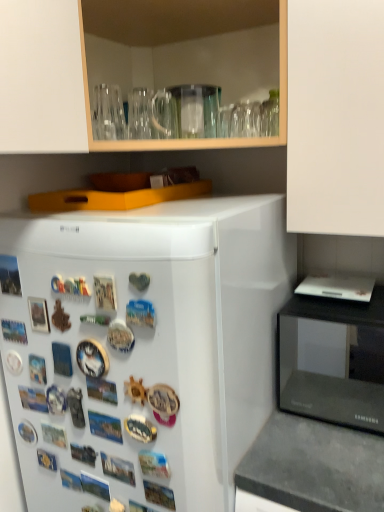
Image resolution: width=384 pixels, height=512 pixels. Find the location of `vacant space in front of black glossy microwave at right`. vacant space in front of black glossy microwave at right is located at coordinates (332, 457).